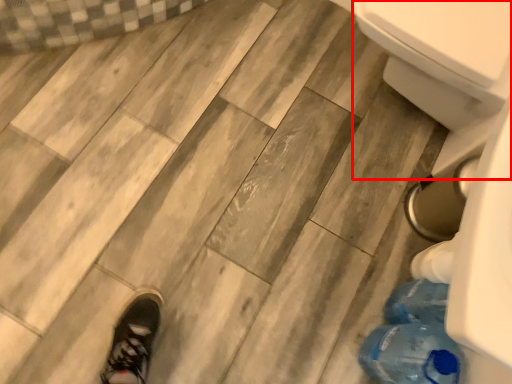
Question: From the image's perspective, where is bidet (annotated by the red box) located in relation to bottle in the image?

Choices:
 (A) above
 (B) below

Answer: (A)